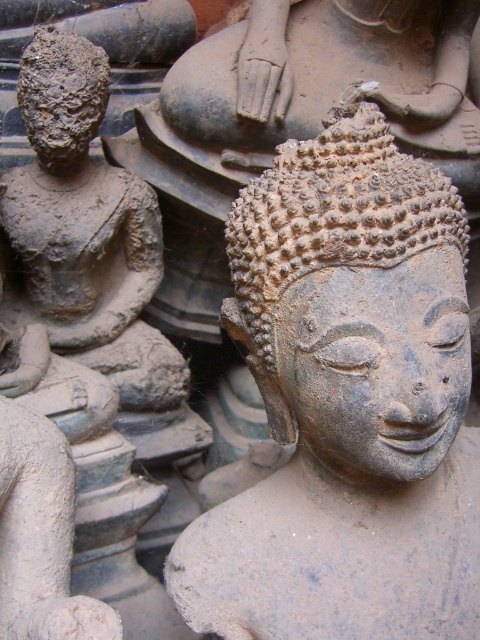
You are an archaeologist examining two ancient heads in a museum display. You notice the matte stone head at center and the matte clay head at left. Which of the two is bigger?

The matte stone head at center is larger in size than the matte clay head at left.

You are an archaeologist examining the ancient sculptures. You notice the matte stone head at center and the matte clay head at left. Which one is closer to you?

The matte stone head at center is closer to you as it is positioned in front of the matte clay head at left.

Looking at the ancient stone sculptures, which object is positioned to the right of the other? Specifically, is the matte stone head at center located to the right of the matte clay head at left, or is it the other way around?

The matte stone head at center is to the right of the matte clay head at left.